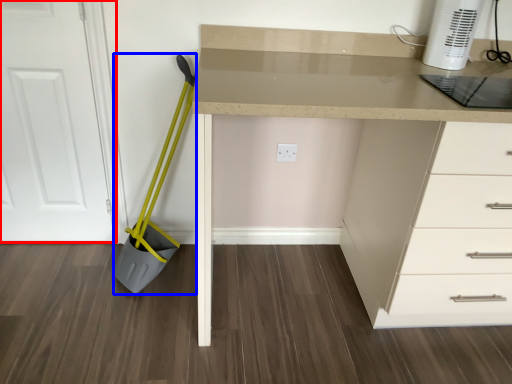
Question: Which object appears closest to the camera in this image, door (highlighted by a red box) or shovel (highlighted by a blue box)?

Choices:
 (A) door
 (B) shovel

Answer: (B)